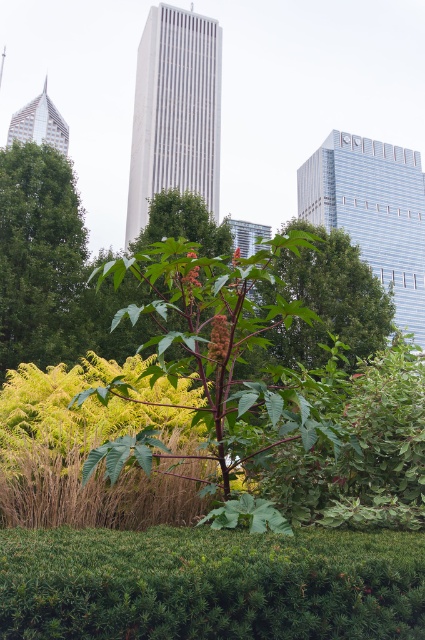
Does green leafy grass at center have a lesser width compared to green leafy tree at center?

Incorrect, green leafy grass at center's width is not less than green leafy tree at center's.

Is green leafy grass at center behind green leafy tree at center?

That is False.

Measure the distance between green leafy grass at center and camera.

6.69 feet

The height and width of the screenshot is (640, 425). In order to click on green leafy grass at center in this screenshot , I will do `click(210, 584)`.

Measure the distance between point (x=413, y=634) and camera.

The distance of point (x=413, y=634) from camera is 8.63 feet.

Which is more to the left, green leafy grass at center or green leafy tree at left?

From the viewer's perspective, green leafy tree at left appears more on the left side.

Between point (362, 611) and point (11, 166), which one is positioned in front?

Point (362, 611) is more forward.

Find the location of `green leafy grass at center`. green leafy grass at center is located at coordinates (210, 584).

Is green leafy tree at left in front of glossy red flower at center?

No.

Measure the distance between green leafy tree at left and camera.

green leafy tree at left is 59.19 feet away from camera.

Image resolution: width=425 pixels, height=640 pixels. Identify the location of green leafy tree at left. (39, 257).